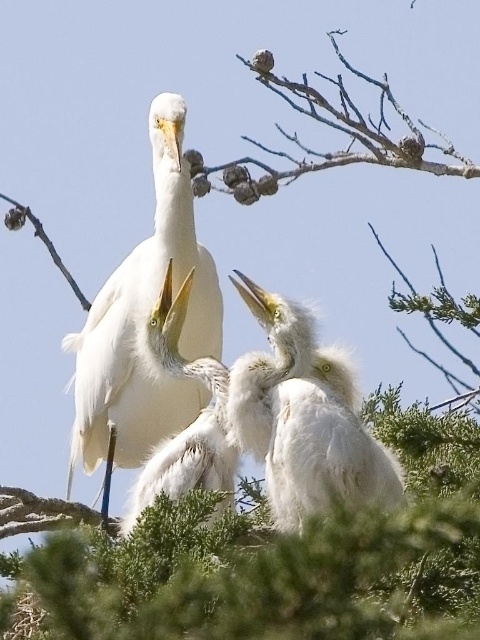
Does white feathered bird at center come in front of white matte bird at center?

No, it is behind white matte bird at center.

What do you see at coordinates (144, 321) in the screenshot? I see `white feathered bird at center` at bounding box center [144, 321].

Which is in front, point (88, 330) or point (165, 364)?

Point (165, 364) is more forward.

The width and height of the screenshot is (480, 640). What are the coordinates of `white feathered bird at center` in the screenshot? It's located at (144, 321).

Image resolution: width=480 pixels, height=640 pixels. What are the coordinates of `white feathered bird at center` in the screenshot? It's located at (144, 321).

Which is more to the left, white feathered bird at center or white fluffy bird at center?

white feathered bird at center is more to the left.

Does point (64, 349) come in front of point (244, 368)?

No, it is not.

You are a GUI agent. You are given a task and a screenshot of the screen. Output one action in this format:
    pyautogui.click(x=<x>, y=<y>)
    Task: Click on the white feathered bird at center
    This screenshot has height=640, width=480.
    Given the screenshot: What is the action you would take?
    pyautogui.click(x=144, y=321)

Can you confirm if white fluffy bird at center is taller than white matte bird at center?

No.

Between white fluffy bird at center and white matte bird at center, which one appears on the left side from the viewer's perspective?

Positioned to the left is white matte bird at center.

Is point (275, 353) less distant than point (213, 380)?

That is True.

Identify the location of white fluffy bird at center. The image size is (480, 640). (303, 419).